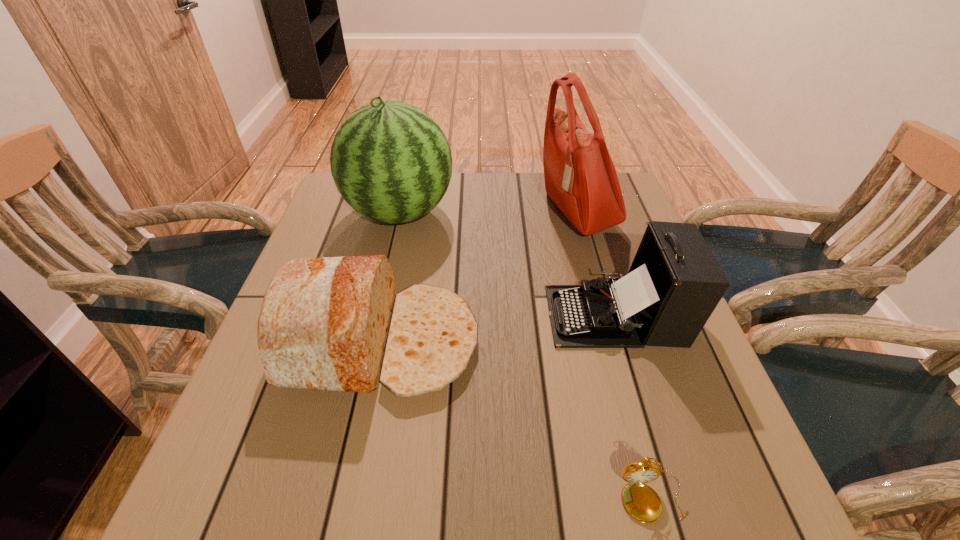
Locate an element on the screen. vacant space positioned 0.250m inside the open case of the typewriter is located at coordinates (435, 315).

Where is `vacant space located inside the open case of the typewriter`? vacant space located inside the open case of the typewriter is located at coordinates (440, 315).

Identify the location of vacant space located 0.160m inside the open case of the typewriter. pyautogui.click(x=475, y=315).

What are the coordinates of `vacant area situated 0.400m at the sliced end of the bread` in the screenshot? It's located at (670, 342).

Locate an element on the screen. handbag at the far edge is located at coordinates (580, 177).

Locate an element on the screen. The width and height of the screenshot is (960, 540). watermelon that is at the far edge is located at coordinates pyautogui.click(x=391, y=162).

Where is `object that is at the near edge`? The height and width of the screenshot is (540, 960). object that is at the near edge is located at coordinates (641, 501).

Where is `watermelon located in the left edge section of the desktop`? watermelon located in the left edge section of the desktop is located at coordinates pos(391,162).

The width and height of the screenshot is (960, 540). I want to click on bread positioned at the left edge, so click(x=334, y=323).

You are a GUI agent. You are given a task and a screenshot of the screen. Output one action in this format:
    pyautogui.click(x=<x>, y=<y>)
    Task: Click on the handbag located in the right edge section of the desktop
    
    Given the screenshot: What is the action you would take?
    [x=580, y=177]